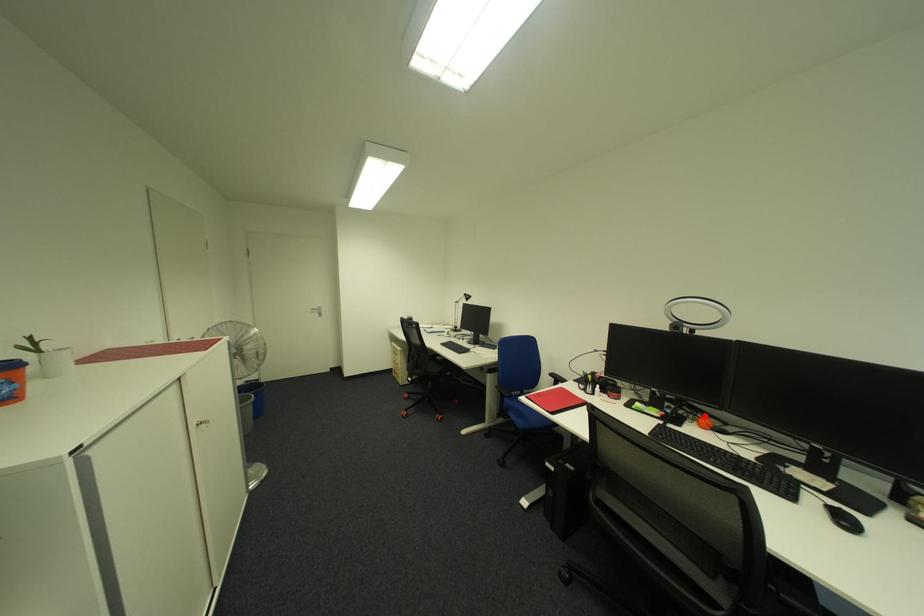
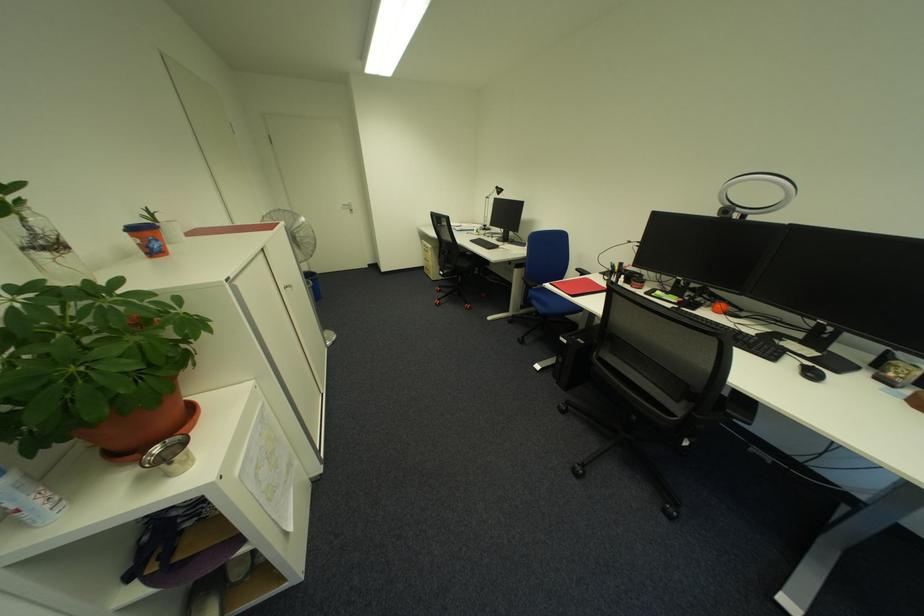
Find the pixel in the second image that matches the highlighted location in the first image.

(723, 302)